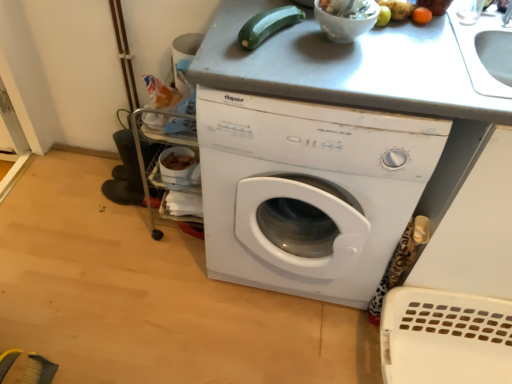
This screenshot has width=512, height=384. I want to click on free space in front of white plastic washing machine at center, so click(x=259, y=343).